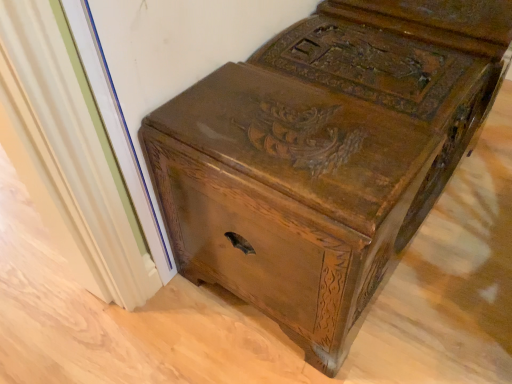
What do you see at coordinates (325, 156) in the screenshot?
I see `wooden carved chest at center` at bounding box center [325, 156].

Measure the distance between wooden carved chest at center and camera.

wooden carved chest at center and camera are 22.76 inches apart.

Where is `wooden carved chest at center`? wooden carved chest at center is located at coordinates (325, 156).

Measure the distance between point (296, 65) and camera.

The depth of point (296, 65) is 36.18 inches.

Find the location of a particular element. This screenshot has height=384, width=512. wooden carved chest at center is located at coordinates (325, 156).